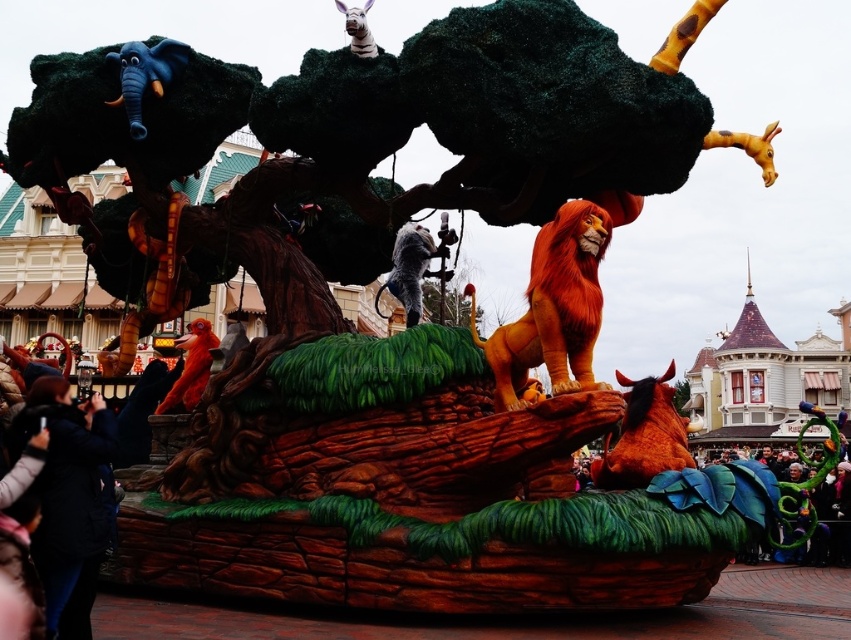
You are a parade attendee standing at the base of the float. You want to take a photo of both the black jacket at lower left and the matte blue elephant at upper left in the same frame. Given that your camera has a maximum zoom range of 10 meters, will you be able to capture both objects in one shot?

The distance between the black jacket at lower left and the matte blue elephant at upper left is 11.33 meters. Since your camera can only zoom up to 10 meters, you won photographer not be able to capture both objects in a single frame.